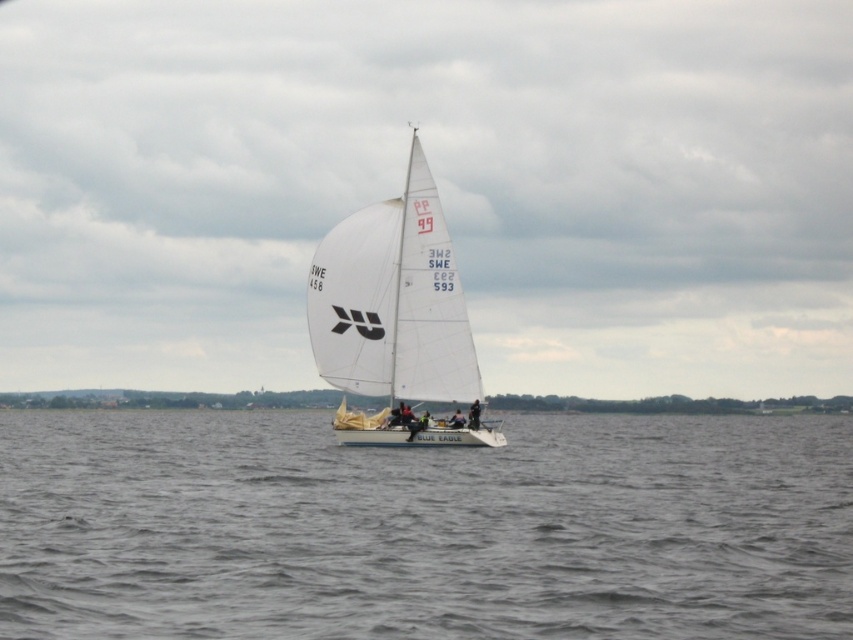
You are a photographer on a nearby boat trying to capture the white matte sailboat at center and the gray water at center in your shot. Based on their heights, which one will appear taller in the photo?

The white matte sailboat at center appears taller in the photo because the gray water at center has a lesser height compared to it.

You are a sailor planning to dock your boat at the shore. You notice the gray water at center and the white matte sailboat at center. Which one is wider?

The gray water at center is wider than the white matte sailboat at center according to the description.

You are standing on the deck of the sailboat and want to reach a specific point in the water marked at coordinates point (653,480). If your current position is 4 meters away from the edge of the deck, can you safely jump to that point without falling into the water?

The distance of point (653,480) from viewer is 42.99 meters. Since you are only 4 meters away from the edge of the deck, jumping to a point 42.99 meters away would be unsafe as it is far beyond your current position.